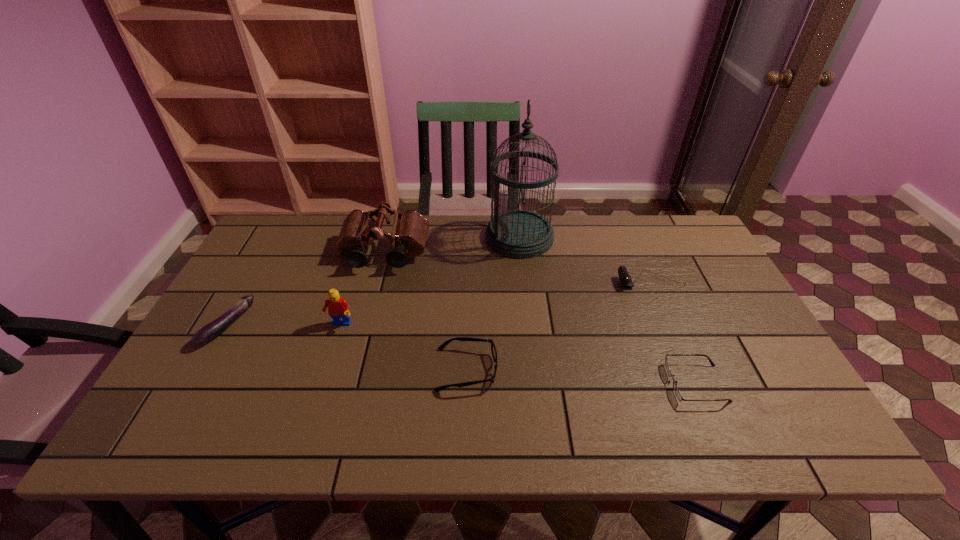
You are a GUI agent. You are given a task and a screenshot of the screen. Output one action in this format:
    pyautogui.click(x=<x>, y=<y>)
    Task: Click on the vacant space located 0.250m on the front-facing side of the right spectacles
    The height and width of the screenshot is (540, 960).
    Given the screenshot: What is the action you would take?
    pyautogui.click(x=562, y=383)

Identify the location of birdcage that is positioned at the far edge. (513, 233).

The image size is (960, 540). I want to click on binoculars present at the far edge, so click(409, 233).

Locate an element on the screen. object positioned at the left edge is located at coordinates (213, 329).

This screenshot has width=960, height=540. I want to click on webcam situated at the right edge, so click(x=625, y=279).

Find the location of `spectacles that is at the right edge`. spectacles that is at the right edge is located at coordinates (676, 390).

In the image, there is a desktop. Where is `vacant space at the far edge`? This screenshot has height=540, width=960. vacant space at the far edge is located at coordinates (593, 249).

In the image, there is a desktop. In order to click on vacant space at the near edge in this screenshot , I will do `click(740, 443)`.

I want to click on vacant space at the left edge, so click(196, 353).

What are the coordinates of `vacant space at the right edge of the desktop` in the screenshot? It's located at [712, 276].